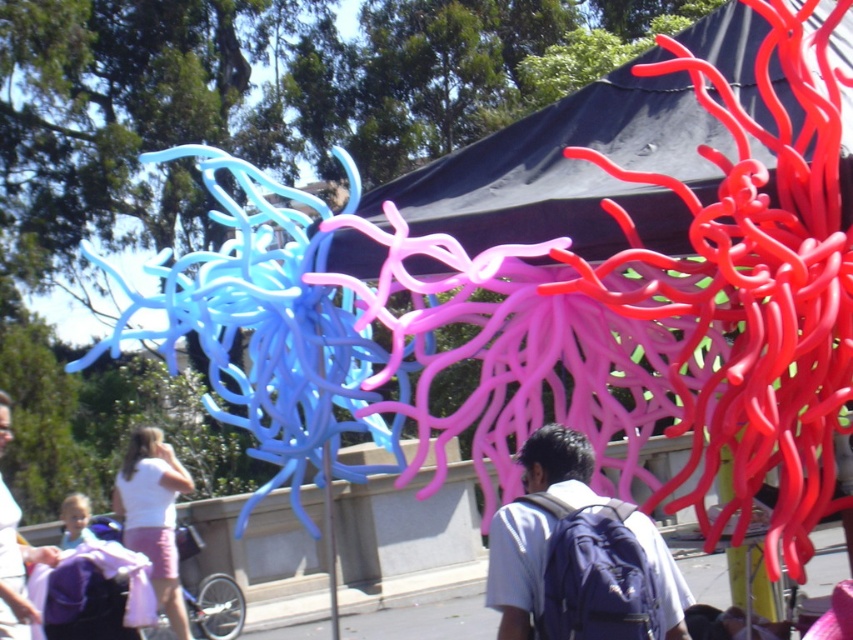
You are standing in front of the sculpture and want to take a photo of the white cotton shirt at lower left without the black fabric canopy at upper center blocking the view. Is the canopy too low to interfere?

The black fabric canopy at upper center is shorter than the white cotton shirt at lower left, so it might be too low and could block the view of the shirt when taking the photo.

You are standing in front of the sculpture and want to take a photo that includes both the point at [618,163] and the point at [537,474]. Based on their positions, which point will appear closer to the front of the photo?

Point [618,163] is further to the camera than point [537,474], so it will appear closer to the front of the photo.

You are standing in front of the sculpture and notice two points marked on the sculpture. The first point is at coordinates point (573,580) and the second is at point (3,522). Which of these points is closer to your viewpoint?

Point (573,580) is closer to the camera than point (3,522), so the first point is closer to your viewpoint.